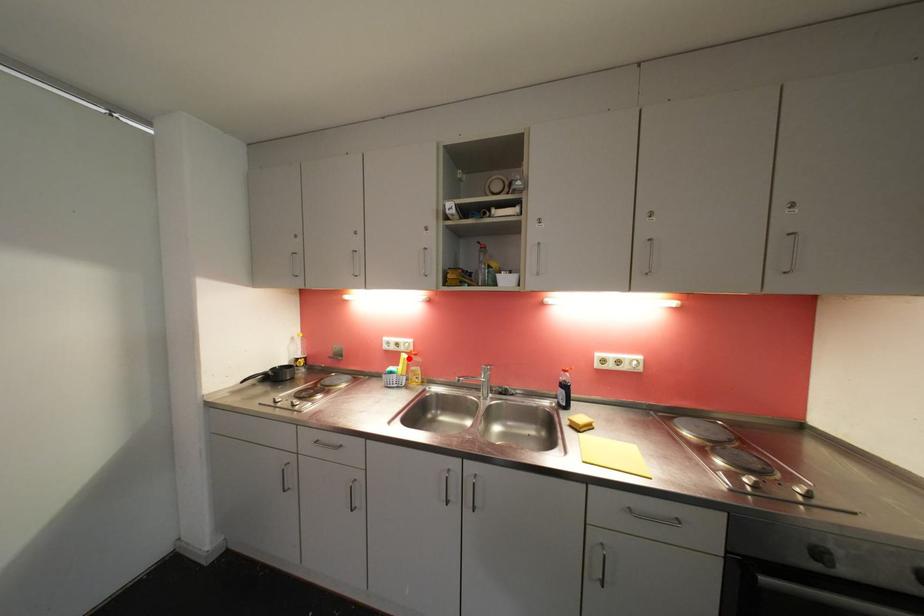
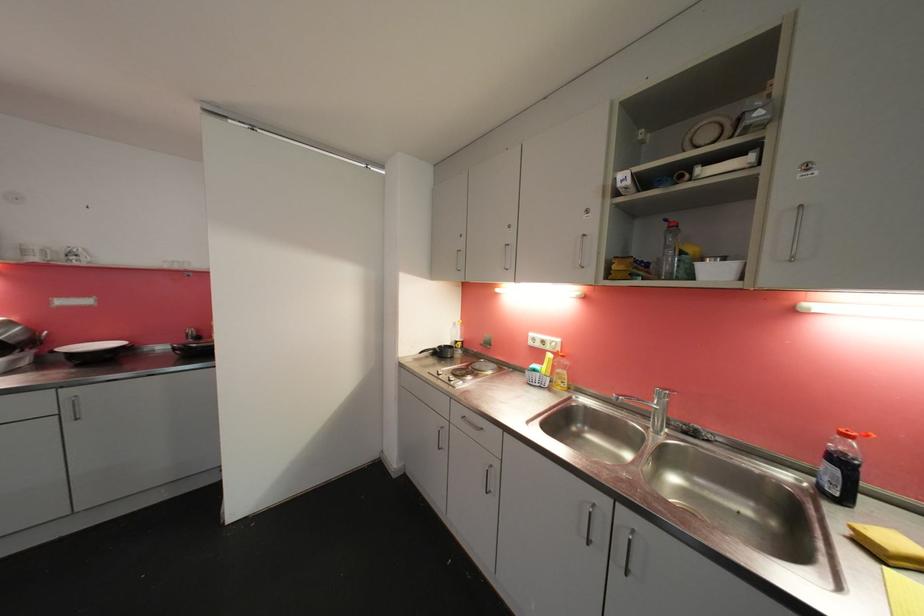
Locate, in the second image, the point that corresponds to the highlighted location in the first image.

(554, 358)